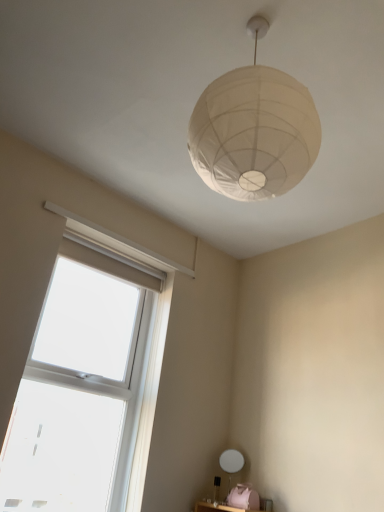
Measure the distance between point (234, 149) and camera.

A distance of 1.27 meters exists between point (234, 149) and camera.

Measure the distance between white matte table lamp at lower center and camera.

The depth of white matte table lamp at lower center is 2.71 meters.

Locate an element on the screen. The image size is (384, 512). white paper lampshade at upper center is located at coordinates (254, 130).

Which point is more distant from viewer, (230, 459) or (87, 353)?

The point (230, 459) is behind.

Between white matte table lamp at lower center and clear glass window at lower left, which one has more height?

clear glass window at lower left is taller.

Is white matte table lamp at lower center inside the boundaries of clear glass window at lower left, or outside?

white matte table lamp at lower center is not inside clear glass window at lower left, it's outside.

I want to click on table lamp that is on the right side of clear glass window at lower left, so click(231, 463).

From a real-world perspective, who is located higher, white paper lampshade at upper center or white matte table lamp at lower center?

white paper lampshade at upper center is physically above.

Which object is closer to the camera, white paper lampshade at upper center or white matte table lamp at lower center?

Positioned in front is white paper lampshade at upper center.

Could you tell me if white paper lampshade at upper center is facing white matte table lamp at lower center?

No, white paper lampshade at upper center is not oriented towards white matte table lamp at lower center.

Locate an element on the screen. The width and height of the screenshot is (384, 512). lamp on the right side of clear glass window at lower left is located at coordinates (254, 130).

Does white paper lampshade at upper center have a lesser width compared to clear glass window at lower left?

In fact, white paper lampshade at upper center might be wider than clear glass window at lower left.

Is white paper lampshade at upper center taller than clear glass window at lower left?

No, white paper lampshade at upper center is not taller than clear glass window at lower left.

Between point (254, 73) and point (120, 375), which one is positioned in front?

Point (254, 73)

Which object is more forward, white matte table lamp at lower center or white paper lampshade at upper center?

Positioned in front is white paper lampshade at upper center.

Which is behind, point (242, 457) or point (216, 177)?

The point (242, 457) is farther.

Is there a large distance between white matte table lamp at lower center and white paper lampshade at upper center?

Yes, white matte table lamp at lower center is far from white paper lampshade at upper center.

From a real-world perspective, relative to white paper lampshade at upper center, is white matte table lamp at lower center vertically above or below?

Clearly, from a real-world perspective, white matte table lamp at lower center is below white paper lampshade at upper center.

In the scene shown: Is clear glass window at lower left taller or shorter than white paper lampshade at upper center?

Clearly, clear glass window at lower left is taller compared to white paper lampshade at upper center.

Does clear glass window at lower left turn towards white paper lampshade at upper center?

Yes, clear glass window at lower left faces towards white paper lampshade at upper center.

Is clear glass window at lower left thinner than white paper lampshade at upper center?

Yes, clear glass window at lower left is thinner than white paper lampshade at upper center.

Is clear glass window at lower left closer to the viewer compared to white paper lampshade at upper center?

That is False.

Is clear glass window at lower left aimed at white matte table lamp at lower center?

No, clear glass window at lower left is not aimed at white matte table lamp at lower center.

Is point (67, 453) farther from camera compared to point (231, 453)?

That is False.

Identify the location of window to the left of white matte table lamp at lower center. Image resolution: width=384 pixels, height=512 pixels. (83, 383).

The image size is (384, 512). Identify the location of table lamp below the clear glass window at lower left (from the image's perspective). (231, 463).

The image size is (384, 512). In order to click on lamp above the white matte table lamp at lower center (from the image's perspective) in this screenshot , I will do `click(254, 130)`.

Estimate the real-world distances between objects in this image. Which object is further from white matte table lamp at lower center, clear glass window at lower left or white paper lampshade at upper center?

white paper lampshade at upper center lies further to white matte table lamp at lower center than the other object.

Which object lies nearer to the anchor point clear glass window at lower left, white paper lampshade at upper center or white matte table lamp at lower center?

white matte table lamp at lower center is closer to clear glass window at lower left.

Considering their positions, is white matte table lamp at lower center positioned closer to clear glass window at lower left than white paper lampshade at upper center?

white matte table lamp at lower center.

Considering their positions, is clear glass window at lower left positioned closer to white paper lampshade at upper center than white matte table lamp at lower center?

Among the two, clear glass window at lower left is located nearer to white paper lampshade at upper center.

Estimate the real-world distances between objects in this image. Which object is further from white paper lampshade at upper center, white matte table lamp at lower center or clear glass window at lower left?

Among the two, white matte table lamp at lower center is located further to white paper lampshade at upper center.

When comparing their distances from white matte table lamp at lower center, does white paper lampshade at upper center or clear glass window at lower left seem closer?

clear glass window at lower left lies closer to white matte table lamp at lower center than the other object.

The width and height of the screenshot is (384, 512). I want to click on window between white paper lampshade at upper center and white matte table lamp at lower center in the up-down direction, so click(x=83, y=383).